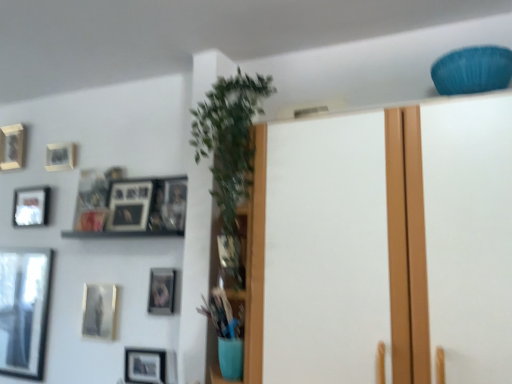
Question: Considering the positions of matte silver picture frame at upper left, the seventh picture frame when ordered from right to left, and matte black picture frame at lower left, positioned as the 3th picture frame in right-to-left order, in the image, is matte silver picture frame at upper left, the seventh picture frame when ordered from right to left, bigger or smaller than matte black picture frame at lower left, positioned as the 3th picture frame in right-to-left order,?

Choices:
 (A) small
 (B) big

Answer: (B)

Question: Is matte silver picture frame at upper left, which appears as the second picture frame when viewed from the left, spatially inside matte black picture frame at lower left, positioned as the 3th picture frame in right-to-left order, or outside of it?

Choices:
 (A) outside
 (B) inside

Answer: (A)

Question: Which object is the closest to the matte silver picture frame at upper left, the seventh picture frame when ordered from right to left?

Choices:
 (A) matte black picture frame at lower center, marked as the seventh picture frame in a left-to-right arrangement
 (B) wooden framed picture at upper left
 (C) matte gold picture frame at center-left, arranged as the 1th picture frame when viewed from the right
 (D) metallic silver picture frame at upper left, which is the fourth picture frame in right-to-left order
 (E) green leafy plant at center

Answer: (B)

Question: Which is nearer to the matte gold picture frame at upper left, marked as the eighth picture frame in a right-to-left arrangement?

Choices:
 (A) matte gold picture frame at center-left, arranged as the 1th picture frame when viewed from the right
 (B) matte silver picture frame at upper left, the seventh picture frame when ordered from right to left
 (C) green leafy plant at center
 (D) matte black picture frame at lower left, positioned as the 3th picture frame in right-to-left order
 (E) metallic silver picture frame at upper left, which is the fifth picture frame from left to right

Answer: (B)